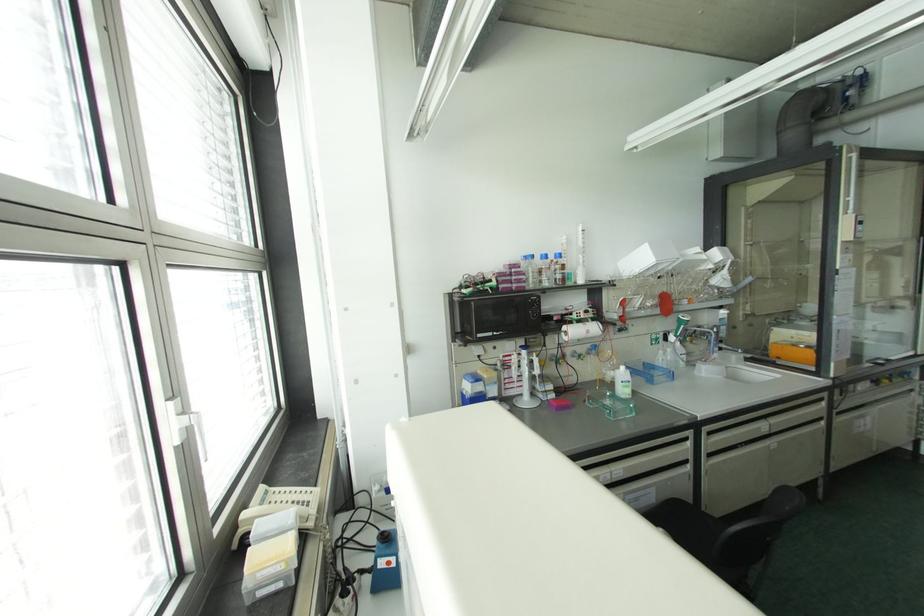
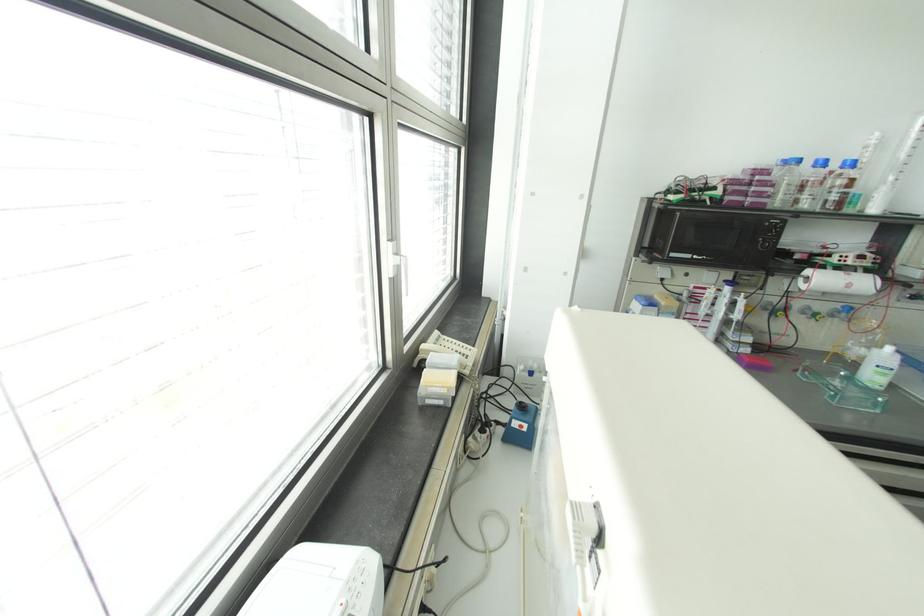
The point at (558, 254) is marked in the first image. Where is the corresponding point in the second image?

(852, 163)